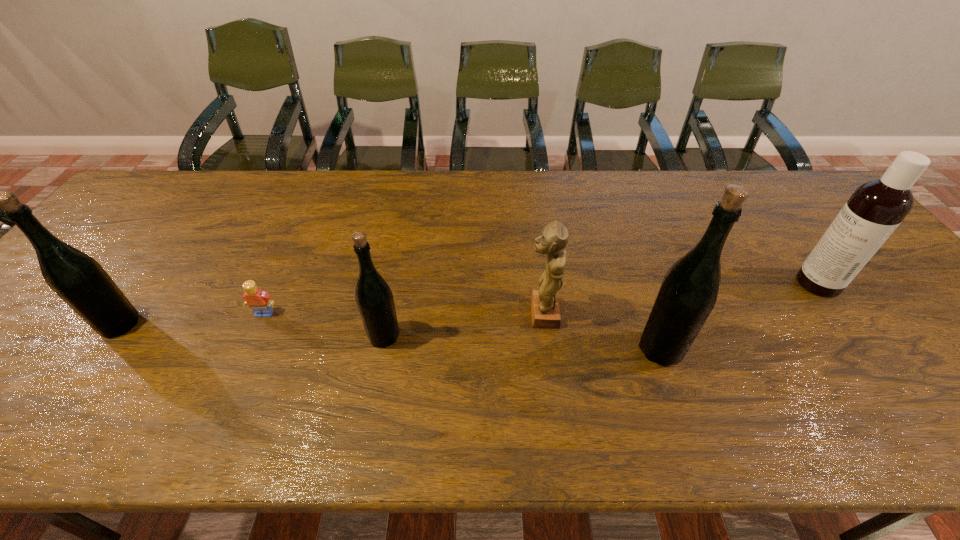
In the image, there is a desktop. At what (x,y) coordinates should I click in order to perform the action: click on vacant space at the far edge. Please return your answer as a coordinate pair (x, y). Looking at the image, I should click on (410, 171).

The width and height of the screenshot is (960, 540). In the image, there is a desktop. Identify the location of free space at the near edge. (281, 379).

Where is `blank area at the left edge`? This screenshot has height=540, width=960. blank area at the left edge is located at coordinates (139, 254).

You are a GUI agent. You are given a task and a screenshot of the screen. Output one action in this format:
    pyautogui.click(x=<x>, y=<y>)
    Task: Click on the vacant area at the right edge of the desktop
    Image resolution: width=960 pixels, height=540 pixels.
    Given the screenshot: What is the action you would take?
    click(x=882, y=261)

Locate an element on the screen. Image resolution: width=960 pixels, height=540 pixels. free region at the far right corner of the desktop is located at coordinates (792, 183).

Locate an element on the screen. The height and width of the screenshot is (540, 960). empty space between the Lego and the leftmost beer bottle is located at coordinates (192, 319).

Find the location of `free space that is in between the fourth object from left to right and the leftmost object`. free space that is in between the fourth object from left to right and the leftmost object is located at coordinates (331, 319).

Locate an element on the screen. The height and width of the screenshot is (540, 960). free area in between the rightmost beer bottle and the fourth object from right to left is located at coordinates (522, 342).

Where is `free space between the second shortest beer bottle and the figurine`? The height and width of the screenshot is (540, 960). free space between the second shortest beer bottle and the figurine is located at coordinates (331, 319).

You are a GUI agent. You are given a task and a screenshot of the screen. Output one action in this format:
    pyautogui.click(x=<x>, y=<y>)
    Task: Click on the free space between the shortest beer bottle and the second object from right to left
    This screenshot has width=960, height=540.
    Given the screenshot: What is the action you would take?
    pyautogui.click(x=522, y=342)